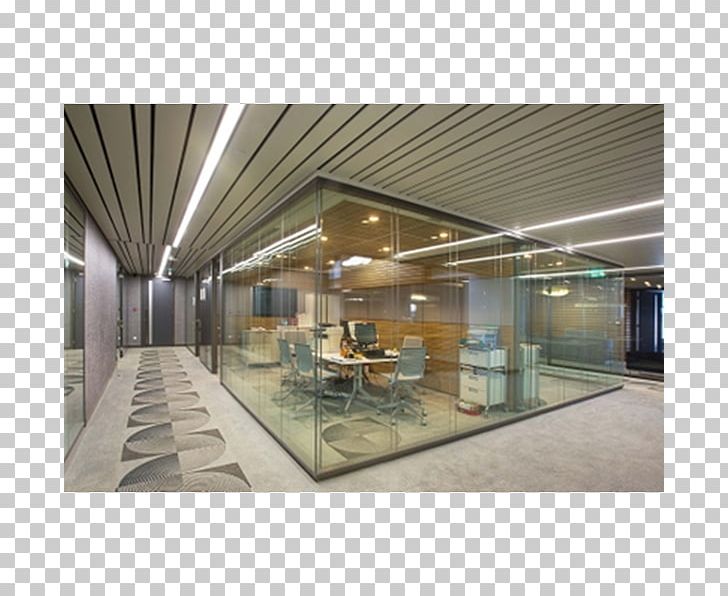
Where is `checkerboard pattern`? The image size is (728, 596). checkerboard pattern is located at coordinates (415, 539), (573, 543), (221, 552), (27, 551), (28, 328), (38, 114), (317, 86), (692, 114), (700, 263), (700, 384).